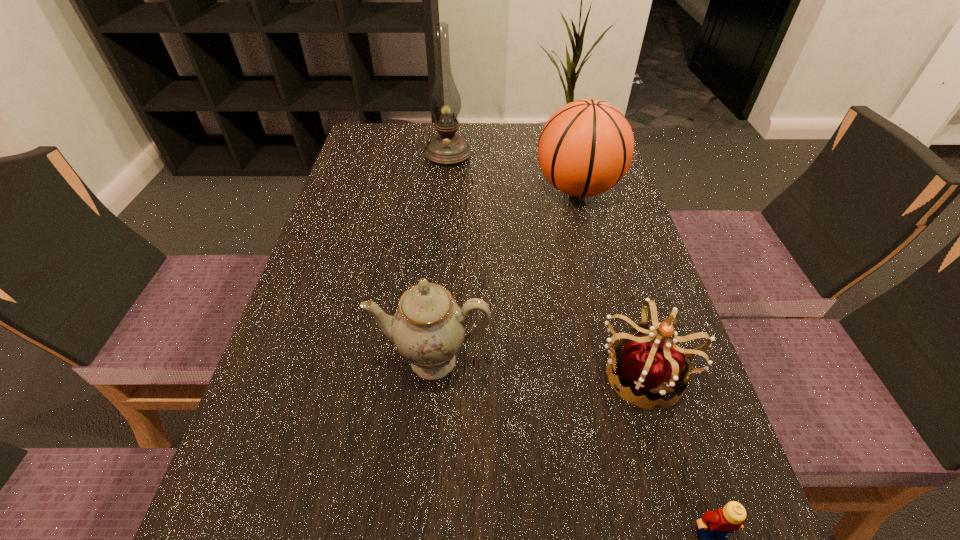
This screenshot has height=540, width=960. Find the location of `oil lamp`. oil lamp is located at coordinates (446, 149).

Where is `basketball`? basketball is located at coordinates (586, 147).

Find the location of a particular element. This screenshot has height=540, width=960. chinaware is located at coordinates (428, 328).

Identify the location of tiara. The width and height of the screenshot is (960, 540). [x=653, y=365].

This screenshot has height=540, width=960. I want to click on free spot located 0.240m on the right of the tallest object, so click(x=557, y=154).

You are a GUI agent. You are given a task and a screenshot of the screen. Output one action in this format:
    pyautogui.click(x=<x>, y=<y>)
    Task: Click on the free location located on the left of the basketball
    
    Given the screenshot: What is the action you would take?
    pyautogui.click(x=418, y=188)

You are a GUI agent. You are given a task and a screenshot of the screen. Output one action in this format:
    pyautogui.click(x=<x>, y=<y>)
    Task: Click on the vacant space located on the spout of the chinaware
    Image resolution: width=960 pixels, height=540 pixels.
    Given the screenshot: What is the action you would take?
    pyautogui.click(x=425, y=444)

Where is `vacant space located on the front-facing side of the tiara`? The height and width of the screenshot is (540, 960). vacant space located on the front-facing side of the tiara is located at coordinates (673, 471).

Where is `oil lamp positioned at the far edge`? oil lamp positioned at the far edge is located at coordinates (446, 149).

Where is `basketball at the far edge`? This screenshot has height=540, width=960. basketball at the far edge is located at coordinates (x=586, y=147).